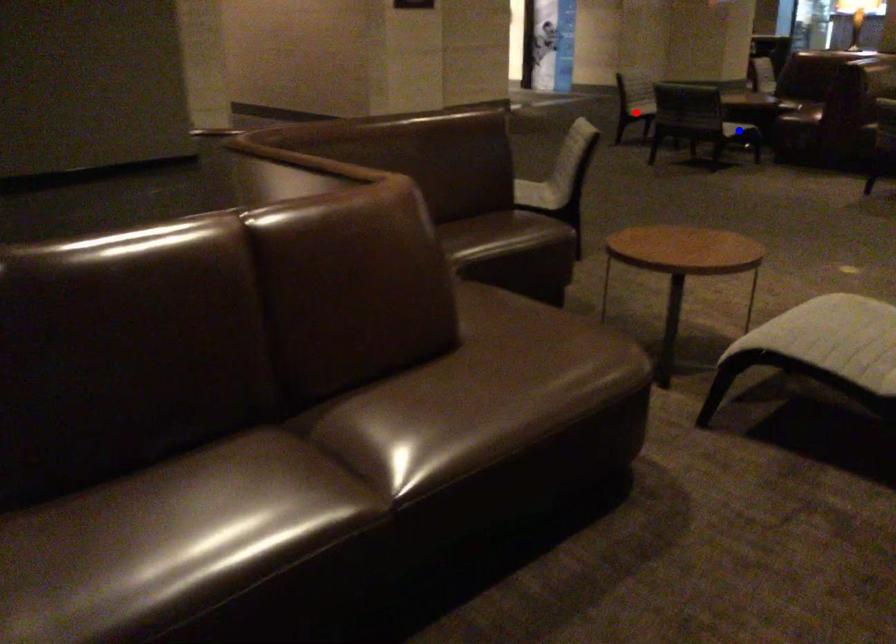
Question: Which of the two points in the image is closer to the camera?

Choices:
 (A) Blue point is closer.
 (B) Red point is closer.

Answer: (A)